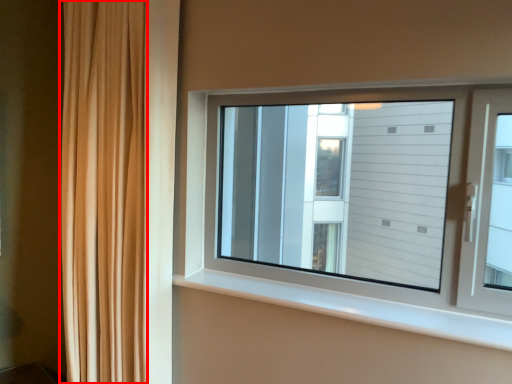
Question: From the image, what is the correct spatial relationship of curtain (annotated by the red box) in relation to window sill?

Choices:
 (A) left
 (B) right

Answer: (A)